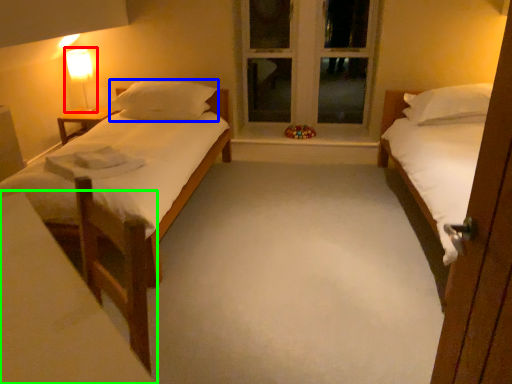
Question: Estimate the real-world distances between objects in this image. Which object is farther from bedside lamp (highlighted by a red box), pillow (highlighted by a blue box) or vanity (highlighted by a green box)?

Choices:
 (A) pillow
 (B) vanity

Answer: (B)